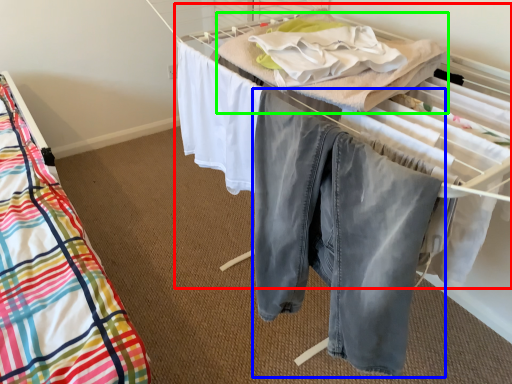
Question: Based on their relative distances, which object is farther from bed (highlighted by a red box)? Choose from trousers (highlighted by a blue box) and blanket (highlighted by a green box).

Choices:
 (A) trousers
 (B) blanket

Answer: (A)